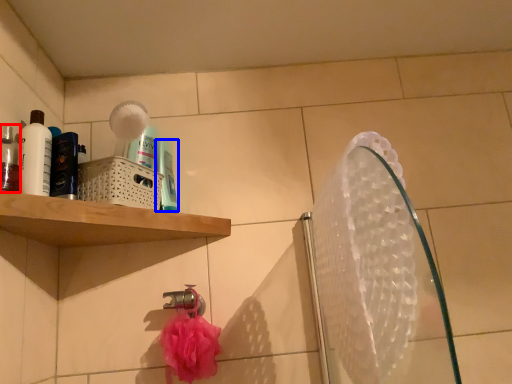
Question: Which object is closer to the camera taking this photo, mouthwash (highlighted by a red box) or mouthwash (highlighted by a blue box)?

Choices:
 (A) mouthwash
 (B) mouthwash

Answer: (A)